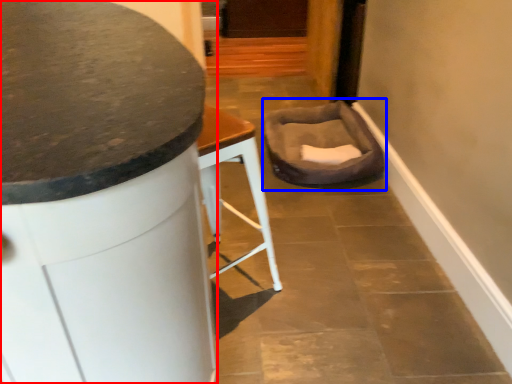
Question: Which of the following is the closest to the observer, furniture (highlighted by a red box) or swivel chair (highlighted by a blue box)?

Choices:
 (A) furniture
 (B) swivel chair

Answer: (A)